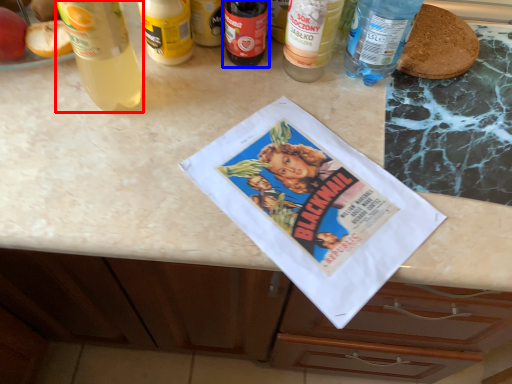
Question: Among these objects, which one is farthest to the camera, bottle (highlighted by a red box) or bottle (highlighted by a blue box)?

Choices:
 (A) bottle
 (B) bottle

Answer: (B)